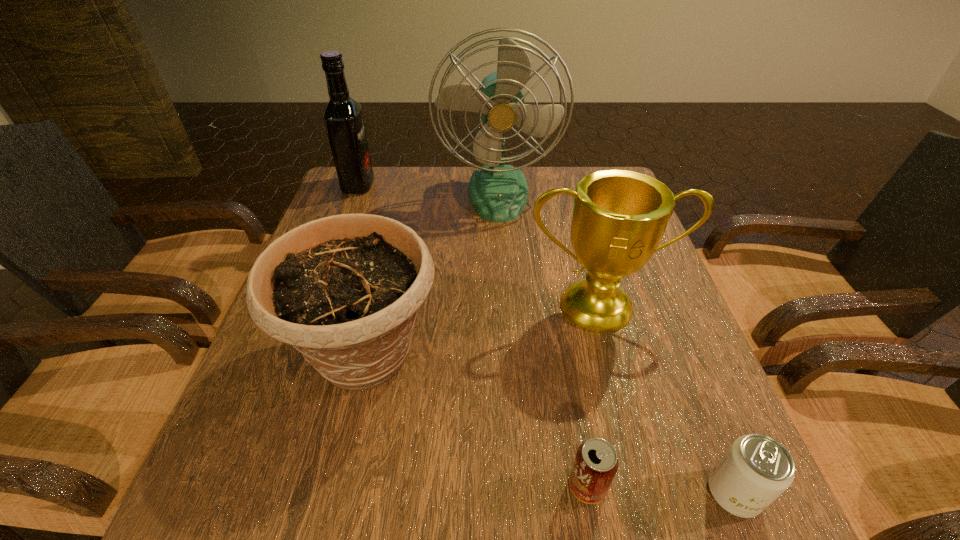
You are a GUI agent. You are given a task and a screenshot of the screen. Output one action in this format:
    pyautogui.click(x=<x>, y=<y>)
    Task: Click on the tallest object
    This screenshot has height=540, width=960.
    Given the screenshot: What is the action you would take?
    pyautogui.click(x=499, y=193)

Identify the location of the fifth shortest object. (343, 117).

The width and height of the screenshot is (960, 540). Find the location of `award`. award is located at coordinates (619, 217).

You are a GUI agent. You are given a task and a screenshot of the screen. Output one action in this format:
    pyautogui.click(x=<x>, y=<y>)
    Task: Click on the fourth tallest object
    Image resolution: width=960 pixels, height=540 pixels.
    Given the screenshot: What is the action you would take?
    pyautogui.click(x=344, y=290)

The width and height of the screenshot is (960, 540). I want to click on the right soda can, so click(x=756, y=469).

Where is `the left soda can`? The image size is (960, 540). the left soda can is located at coordinates (596, 462).

Find the location of a particular element. free location located in front of the fan, directing airflow is located at coordinates (503, 278).

At what (x,y) coordinates should I click in order to perform the action: click on free region located on the front-facing side of the liquor. Please return your answer as a coordinate pair (x, y). Looking at the image, I should click on (394, 185).

Identify the location of vacant area located on the shiny surface of the fourth shortest object. (645, 479).

Find the location of a particular element. The height and width of the screenshot is (540, 960). free region located 0.050m on the back of the fourth tallest object is located at coordinates pos(382,285).